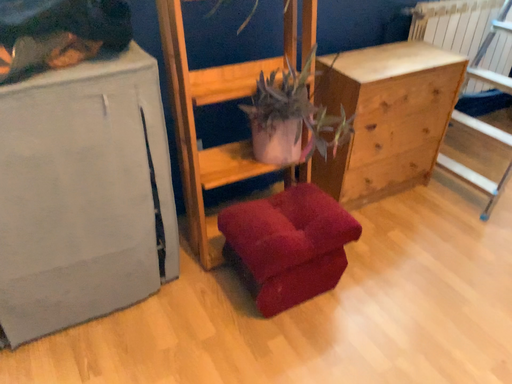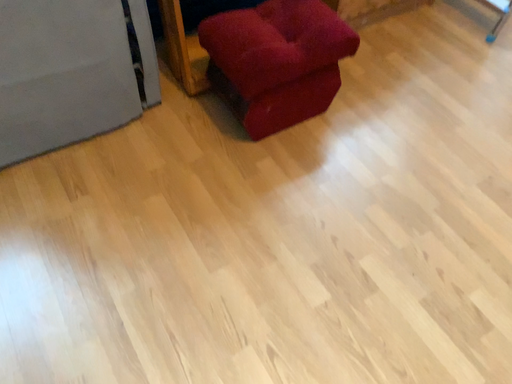
Question: Which way did the camera rotate in the video?

Choices:
 (A) rotated downward
 (B) rotated upward

Answer: (A)